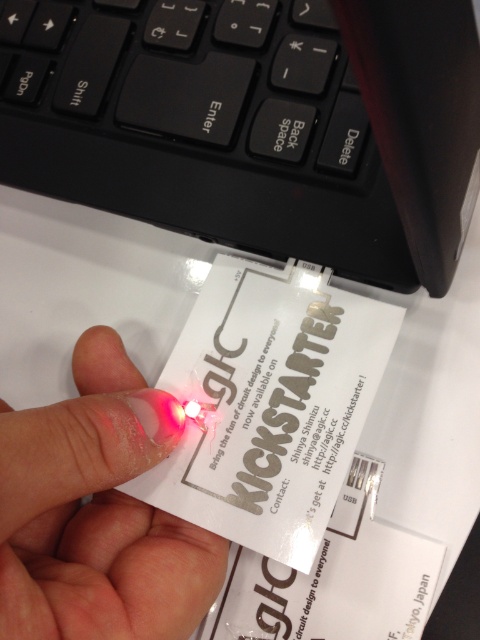
In the scene shown: Is white paper at center thinner than transparent plastic at center?

In fact, white paper at center might be wider than transparent plastic at center.

Is white paper at center shorter than transparent plastic at center?

No.

Is point (272, 440) positioned in front of point (47, 497)?

No.

Where is `white paper at center`? white paper at center is located at coordinates (269, 404).

Does black matte keyboard at upper center have a smaller size compared to transparent plastic at center?

No.

Which is above, black matte keyboard at upper center or transparent plastic at center?

black matte keyboard at upper center is above.

Where is `black matte keyboard at upper center`? The width and height of the screenshot is (480, 640). black matte keyboard at upper center is located at coordinates (188, 84).

Locate an element on the screen. The height and width of the screenshot is (640, 480). black matte keyboard at upper center is located at coordinates (188, 84).

Does point (29, 118) come in front of point (135, 486)?

No, (29, 118) is further to viewer.

Identify the location of black matte keyboard at upper center. coord(188,84).